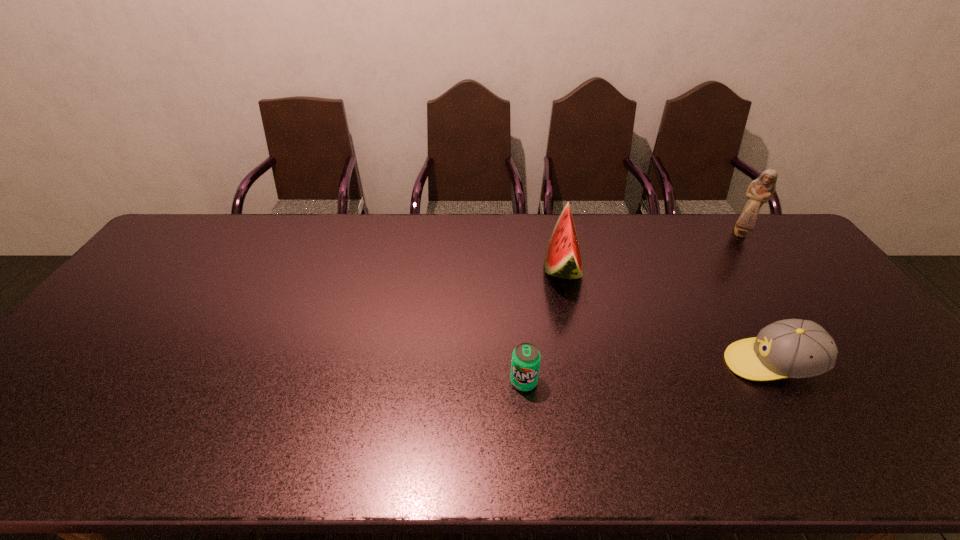
Identify the location of free region located 0.120m on the front-facing side of the third object from left to right. (679, 364).

Locate an element on the screen. free space located 0.240m on the front-facing side of the third object from left to right is located at coordinates (632, 364).

Find the location of a particular element. free location located 0.240m on the front-facing side of the third object from left to right is located at coordinates (632, 364).

Identify the location of vacant area situated 0.120m on the front-facing side of the pop soda. (529, 440).

Where is `figurine that is at the far edge`? This screenshot has height=540, width=960. figurine that is at the far edge is located at coordinates (760, 191).

You are a GUI agent. You are given a task and a screenshot of the screen. Output one action in this format:
    pyautogui.click(x=<x>, y=<y>)
    Task: Click on the watermelon positioned at the far edge
    
    Given the screenshot: What is the action you would take?
    pyautogui.click(x=563, y=259)

This screenshot has height=540, width=960. In order to click on object at the right edge in this screenshot , I will do `click(760, 191)`.

What are the coordinates of `object that is at the far right corner` in the screenshot? It's located at click(760, 191).

Where is `vacant space at the far edge of the desktop`? The width and height of the screenshot is (960, 540). vacant space at the far edge of the desktop is located at coordinates (311, 245).

Where is `vacant area at the near edge`? vacant area at the near edge is located at coordinates (435, 430).